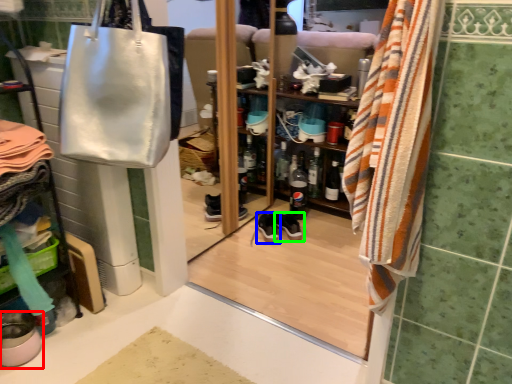
Question: Based on their relative distances, which object is nearer to footwear (highlighted by a red box)? Choose from shoe (highlighted by a blue box) and footwear (highlighted by a green box).

Choices:
 (A) shoe
 (B) footwear

Answer: (A)